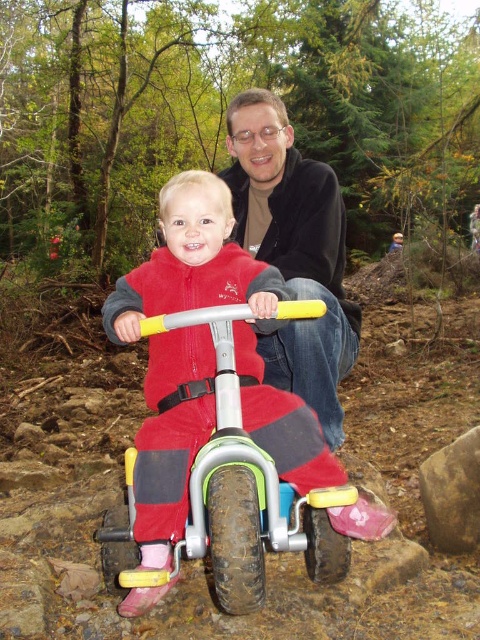
You are a photographer trying to capture a portrait of the matte black jacket at upper center and the brown rough rock at lower right. Which object should you focus on first if you want to ensure both are in the frame without moving the camera?

The matte black jacket at upper center should be focused on first since it is taller than the brown rough rock at lower right, ensuring both can fit within the frame by adjusting the camera angle accordingly.

You are a delivery person trying to deliver a package to the adult wearing the matte black jacket at upper center. The delivery requires the package to be placed on the rubberized plastic tricycle at center. Will the package fit on the tricycle if the package is as wide as the adult?

The rubberized plastic tricycle at center is wider than the matte black jacket at upper center, so the package should fit since the tricycle is wider than the adult.